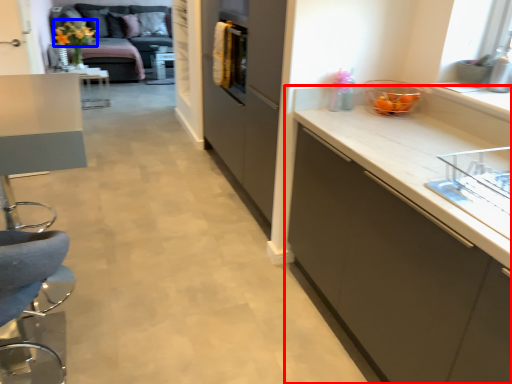
Question: Which object appears farthest to the camera in this image, cabinetry (highlighted by a red box) or flower (highlighted by a blue box)?

Choices:
 (A) cabinetry
 (B) flower

Answer: (B)